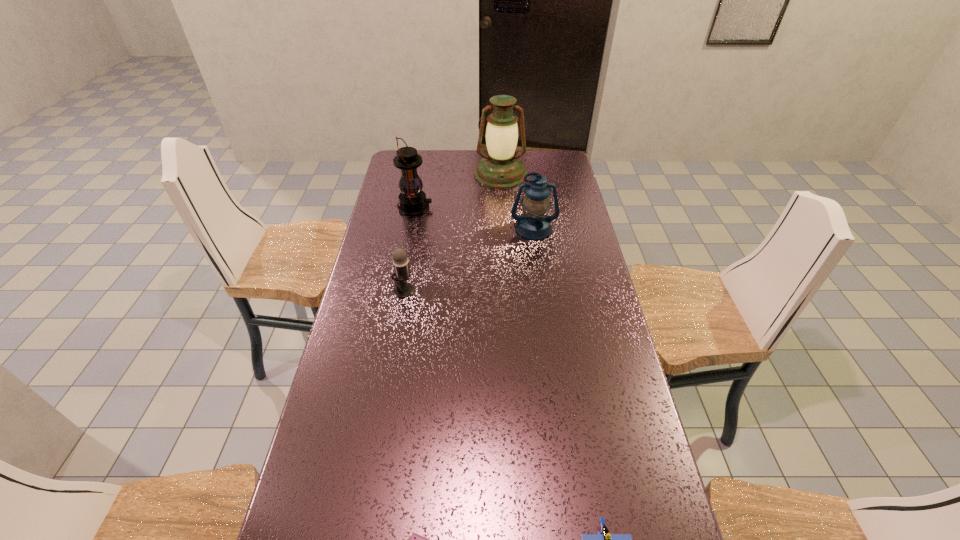
Identify the location of vacant area located on the back of the fourth farthest object. (407, 270).

The height and width of the screenshot is (540, 960). In order to click on object positioned at the far edge in this screenshot , I will do pos(501,168).

Find the location of a particular element. This screenshot has height=540, width=960. lantern present at the left edge is located at coordinates (412, 200).

You are a GUI agent. You are given a task and a screenshot of the screen. Output one action in this format:
    pyautogui.click(x=<x>, y=<y>)
    Task: Click on the microphone that is positioned at the left edge
    
    Given the screenshot: What is the action you would take?
    pyautogui.click(x=400, y=260)

Locate an element on the screen. The image size is (960, 540). object at the right edge is located at coordinates (534, 224).

Find the location of a particular element. Image resolution: width=960 pixels, height=540 pixels. vacant space at the left edge of the desktop is located at coordinates (395, 222).

Where is `free space at the right edge of the desktop`? This screenshot has width=960, height=540. free space at the right edge of the desktop is located at coordinates (558, 246).

Find the location of `vacant point located between the fourth tallest object and the farthest object`. vacant point located between the fourth tallest object and the farthest object is located at coordinates (452, 232).

Where is `free spot between the second farthest lantern and the third tallest object`? free spot between the second farthest lantern and the third tallest object is located at coordinates (474, 218).

This screenshot has width=960, height=540. In order to click on free space between the farthest lantern and the third nearest object in this screenshot , I will do `click(452, 232)`.